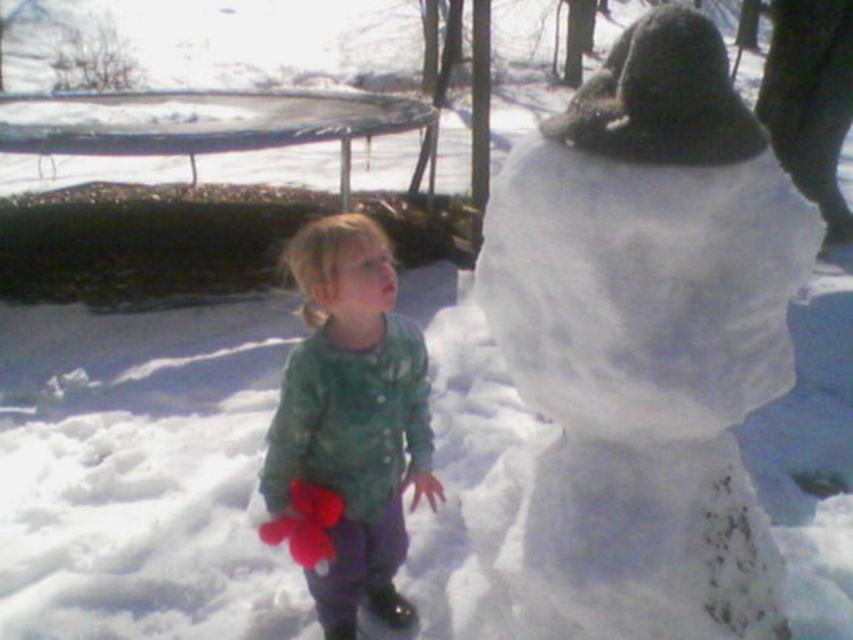
Question: Which object appears farthest from the camera in this image?

Choices:
 (A) white fluffy snowman at upper right
 (B) green textured coat at center

Answer: (B)

Question: Is white fluffy snowman at upper right wider than green textured coat at center?

Choices:
 (A) yes
 (B) no

Answer: (A)

Question: Does white fluffy snowman at upper right appear on the left side of green textured coat at center?

Choices:
 (A) no
 (B) yes

Answer: (A)

Question: Is white fluffy snowman at upper right to the left of green textured coat at center from the viewer's perspective?

Choices:
 (A) no
 (B) yes

Answer: (A)